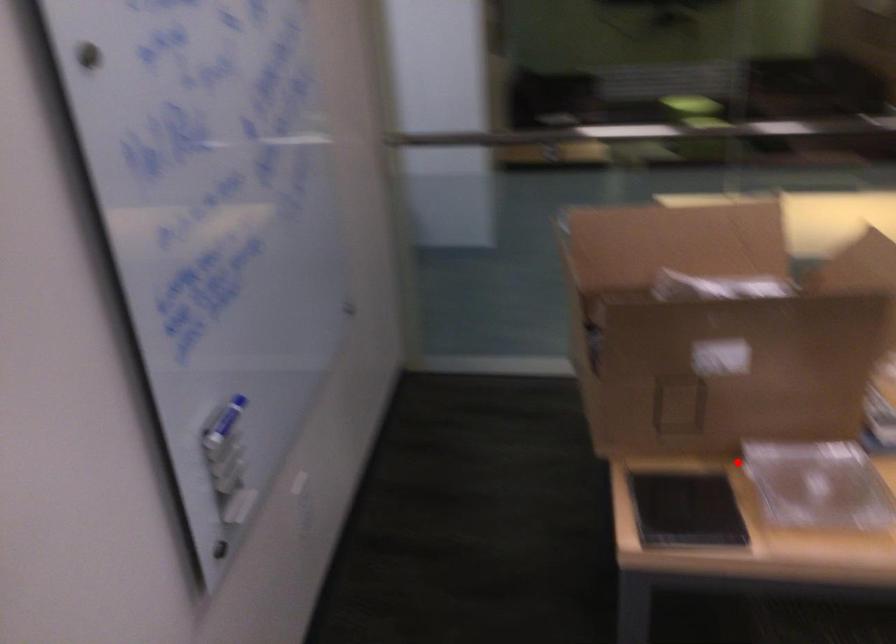
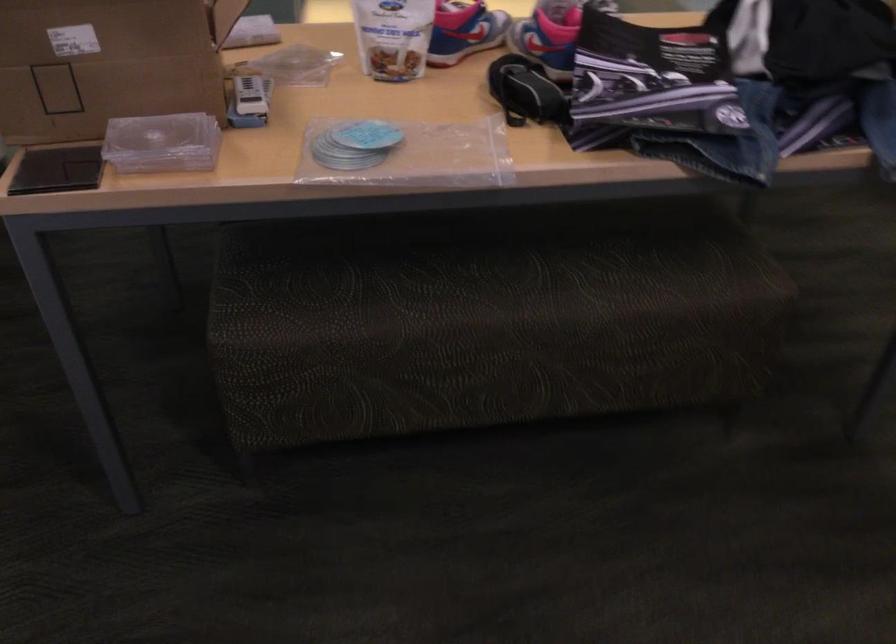
Question: I am providing you with two images of the same scene from different viewpoints. In image1, a red point is highlighted. Considering the same 3D point in image2, which of the following is correct?

Choices:
 (A) It is closer
 (B) It is farther

Answer: (B)